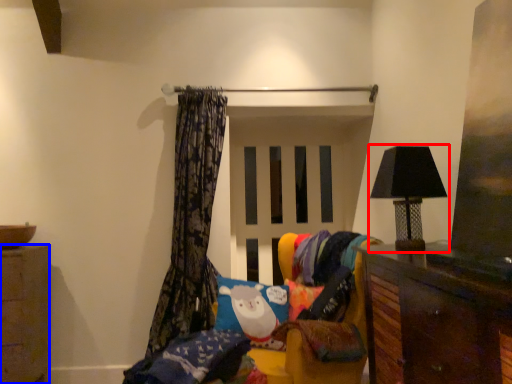
Question: Which of the following is the farthest to the observer, lamp (highlighted by a red box) or cabinetry (highlighted by a blue box)?

Choices:
 (A) lamp
 (B) cabinetry

Answer: (B)